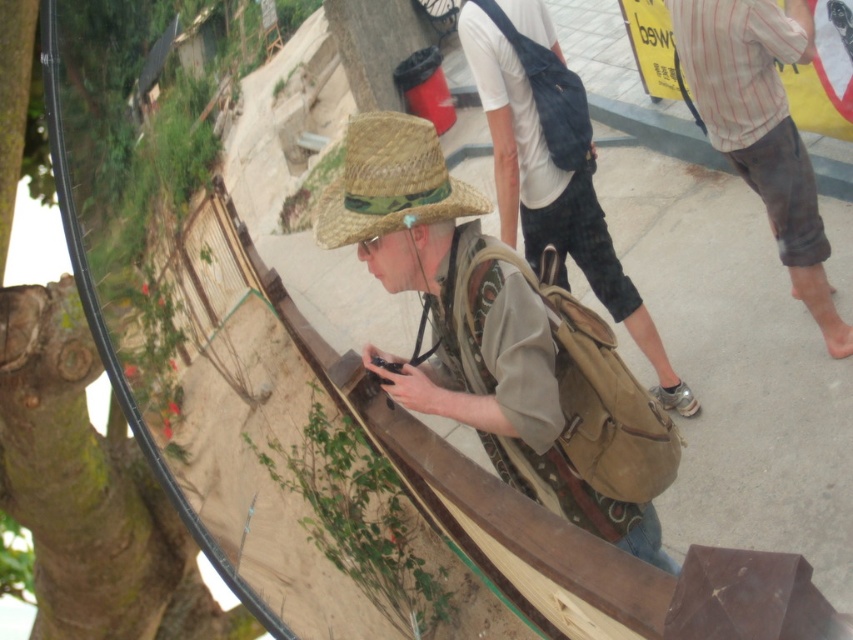
Question: Among these objects, which one is nearest to the camera?

Choices:
 (A) striped cotton shirt at upper right
 (B) strawhat at center
 (C) green rough bark tree at left
 (D) matte brown backpack at center

Answer: (B)

Question: Is matte brown backpack at center to the left of strawhat at center from the viewer's perspective?

Choices:
 (A) no
 (B) yes

Answer: (A)

Question: Which point is closer to the camera?

Choices:
 (A) matte brown backpack at center
 (B) matte straw hat at center
 (C) green rough bark tree at left
 (D) striped cotton shirt at upper right

Answer: (B)

Question: Among these points, which one is farthest from the camera?

Choices:
 (A) (537, 147)
 (B) (476, 256)
 (C) (144, 586)

Answer: (C)

Question: Is green rough bark tree at left below matte brown backpack at center?

Choices:
 (A) no
 (B) yes

Answer: (B)

Question: Can you confirm if striped cotton shirt at upper right is positioned to the right of matte brown backpack at center?

Choices:
 (A) no
 (B) yes

Answer: (B)